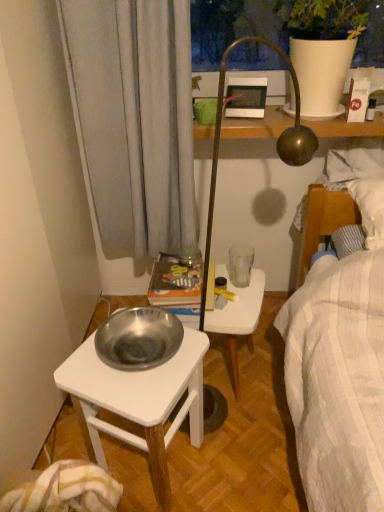
Find the location of a particular element. This screenshot has width=384, height=512. vacant area that is in front of white plastic stool at center is located at coordinates (245, 443).